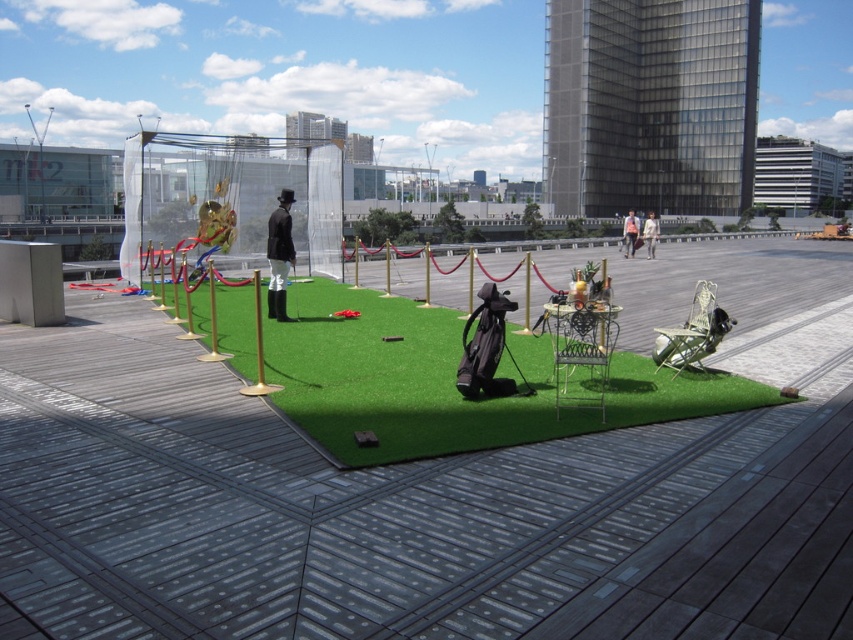
Question: Is metallic silver chair at center bigger than pink fabric at center?

Choices:
 (A) no
 (B) yes

Answer: (A)

Question: Which point is closer to the camera taking this photo?

Choices:
 (A) (653, 232)
 (B) (367, 396)

Answer: (B)

Question: Can you confirm if metallic silver chair at lower right is positioned below light beige fabric coat at center?

Choices:
 (A) yes
 (B) no

Answer: (A)

Question: Which point is farther from the camera taking this photo?

Choices:
 (A) (527, 362)
 (B) (654, 346)

Answer: (A)

Question: Which point is farther from the camera taking this photo?

Choices:
 (A) (289, 198)
 (B) (631, 216)

Answer: (B)

Question: Does pink fabric at center appear under light beige fabric coat at center?

Choices:
 (A) no
 (B) yes

Answer: (A)